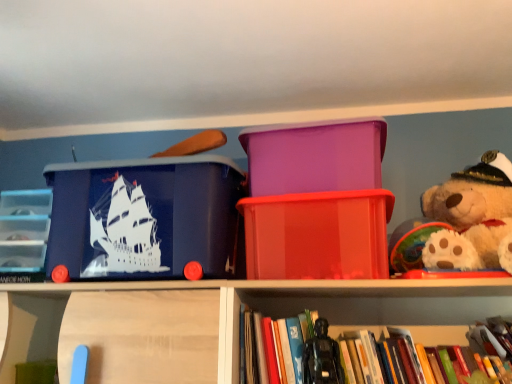
Question: Does hardcover book at center have a greater width compared to purple plastic container at center, the second storage box positioned from the left?

Choices:
 (A) no
 (B) yes

Answer: (A)

Question: From the image's perspective, is hardcover book at center located beneath purple plastic container at center, the second storage box positioned from the left?

Choices:
 (A) no
 (B) yes

Answer: (B)

Question: From a real-world perspective, does hardcover book at center stand above purple plastic container at center, the second storage box positioned from the left?

Choices:
 (A) yes
 (B) no

Answer: (B)

Question: Is hardcover book at center behind purple plastic container at center, the second storage box viewed from the right?

Choices:
 (A) yes
 (B) no

Answer: (B)

Question: Are hardcover book at center and purple plastic container at center, the second storage box positioned from the left, located far from each other?

Choices:
 (A) no
 (B) yes

Answer: (A)

Question: From a real-world perspective, is hardcover book at center positioned above or below clear plastic drawers at left?

Choices:
 (A) below
 (B) above

Answer: (A)

Question: Considering their positions, is hardcover book at center located in front of or behind clear plastic drawers at left?

Choices:
 (A) front
 (B) behind

Answer: (A)

Question: Looking at their shapes, would you say hardcover book at center is wider or thinner than clear plastic drawers at left?

Choices:
 (A) thin
 (B) wide

Answer: (B)

Question: In terms of height, does hardcover book at center look taller or shorter compared to clear plastic drawers at left?

Choices:
 (A) short
 (B) tall

Answer: (A)

Question: From a real-world perspective, is matte blue plastic storage box at left, which is counted as the 3th storage box, starting from the right, above or below hardcover book at center?

Choices:
 (A) above
 (B) below

Answer: (A)

Question: Would you say matte blue plastic storage box at left, which is counted as the 3th storage box, starting from the right, is inside or outside hardcover book at center?

Choices:
 (A) inside
 (B) outside

Answer: (B)

Question: In terms of size, does matte blue plastic storage box at left, which is counted as the 3th storage box, starting from the right, appear bigger or smaller than hardcover book at center?

Choices:
 (A) small
 (B) big

Answer: (B)

Question: Is matte blue plastic storage box at left, the 1th storage box from the left, taller or shorter than hardcover book at center?

Choices:
 (A) tall
 (B) short

Answer: (A)

Question: From their relative heights in the image, would you say black plastic action figure at lower center is taller or shorter than translucent red plastic container at center, marked as the 1th storage box in a right-to-left arrangement?

Choices:
 (A) tall
 (B) short

Answer: (A)

Question: Choose the correct answer: Is black plastic action figure at lower center inside translucent red plastic container at center, marked as the 1th storage box in a right-to-left arrangement, or outside it?

Choices:
 (A) inside
 (B) outside

Answer: (B)